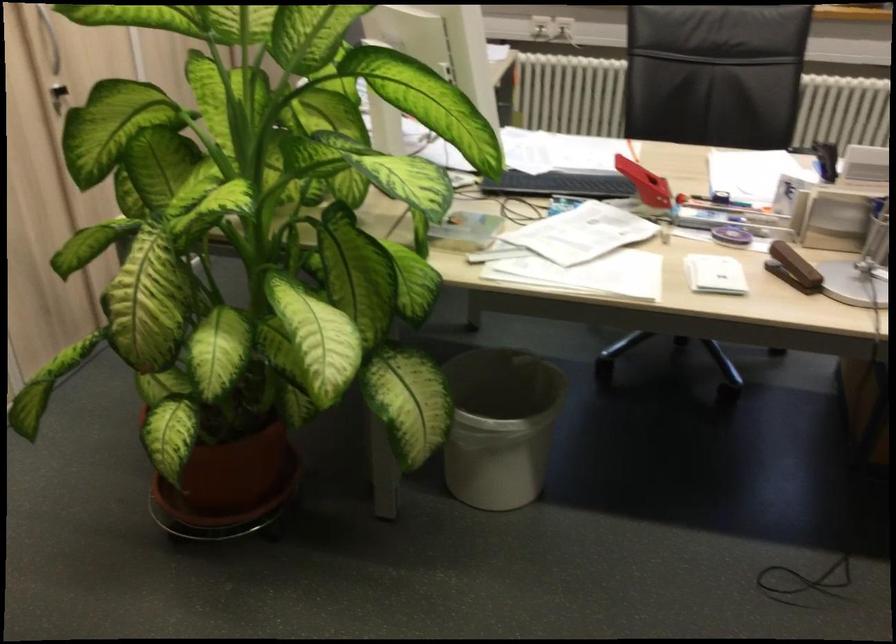
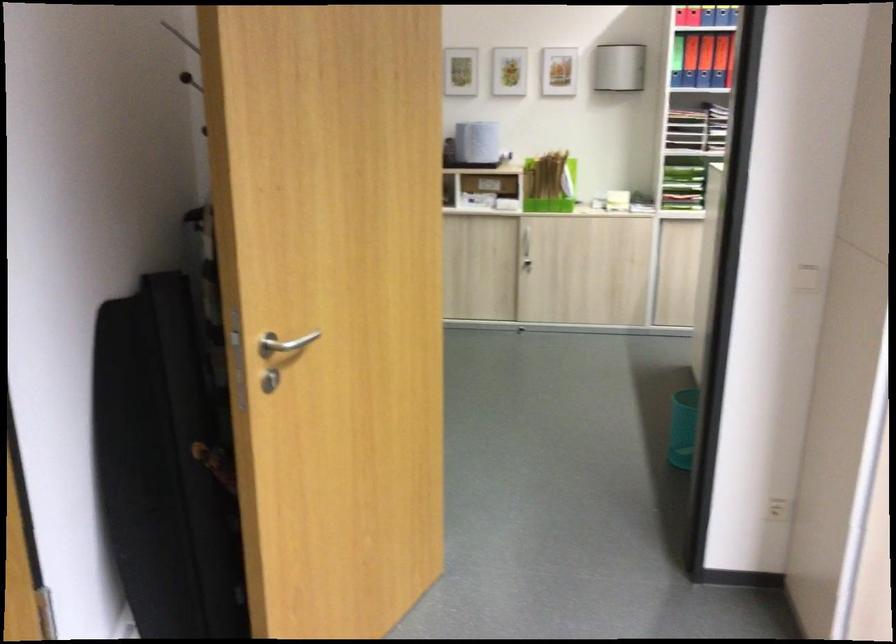
Question: The camera is either moving clockwise (left) or counter-clockwise (right) around the object. The first image is from the beginning of the video and the second image is from the end. Is the camera moving left or right when shooting the video?

Choices:
 (A) Left
 (B) Right

Answer: (B)